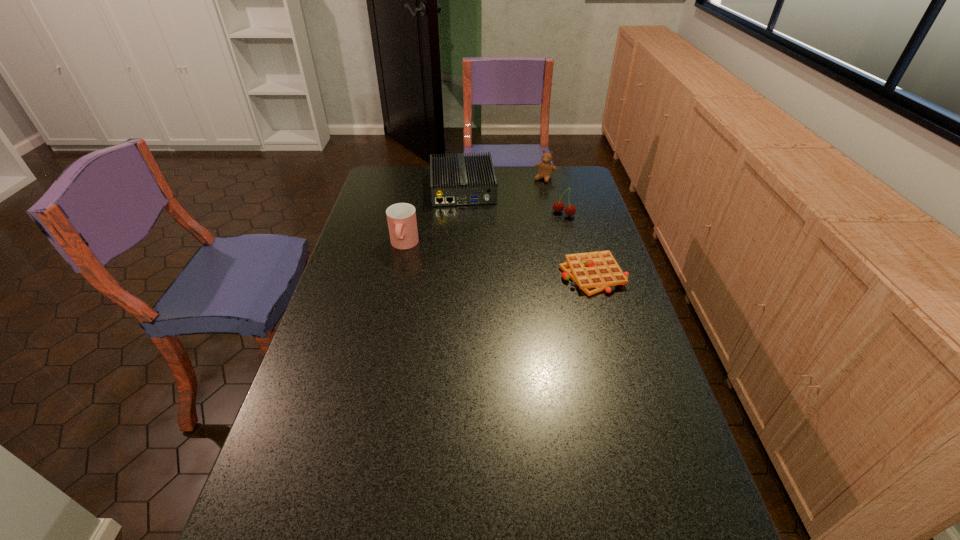
Find the location of a particular element. free spot on the desktop that is between the cup and the waffle and is positioned on the face of the teddy bear is located at coordinates (483, 257).

This screenshot has width=960, height=540. Find the location of `vacant space on the desktop that is between the leftmost object and the waffle and is positioned on the back panel of the fourth object from right to left`. vacant space on the desktop that is between the leftmost object and the waffle and is positioned on the back panel of the fourth object from right to left is located at coordinates (470, 255).

Locate an element on the screen. Image resolution: width=960 pixels, height=540 pixels. vacant space on the desktop that is between the cup and the waffle and is positioned on the surface of the cherry is located at coordinates (507, 261).